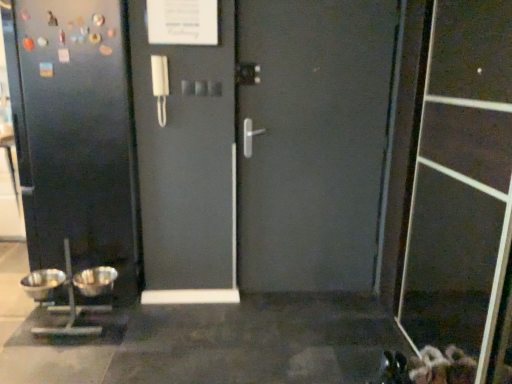
The width and height of the screenshot is (512, 384). What do you see at coordinates (77, 137) in the screenshot? I see `metallic gray door at center` at bounding box center [77, 137].

At what (x,y) coordinates should I click in order to perform the action: click on silver metallic mixing bowl at lower left, marked as the 1th mixing bowl in a right-to-left arrangement. Please return your answer as a coordinate pair (x, y). This screenshot has width=512, height=384. Looking at the image, I should click on (95, 281).

Is silver metallic mixing bowl at lower left, the 2th mixing bowl when ordered from right to left, completely or partially outside of metallic gray door at center?

Yes, silver metallic mixing bowl at lower left, the 2th mixing bowl when ordered from right to left, is outside of metallic gray door at center.

Is there a large distance between silver metallic mixing bowl at lower left, which appears as the 1th mixing bowl when viewed from the left, and metallic gray door at center?

silver metallic mixing bowl at lower left, which appears as the 1th mixing bowl when viewed from the left, is actually quite close to metallic gray door at center.

Which point is more forward, (28,279) or (19,137)?

The point (19,137) is more forward.

Is silver metallic mixing bowl at lower left, which appears as the 1th mixing bowl when viewed from the left, looking in the opposite direction of metallic gray door at center?

Yes, silver metallic mixing bowl at lower left, which appears as the 1th mixing bowl when viewed from the left, is facing away from metallic gray door at center.

Is metallic gray door at center to the right of transparent plastic screen door at lower right from the viewer's perspective?

No, metallic gray door at center is not to the right of transparent plastic screen door at lower right.

Would you say metallic gray door at center is outside transparent plastic screen door at lower right?

Yes, metallic gray door at center is outside of transparent plastic screen door at lower right.

From the picture: From the image's perspective, would you say metallic gray door at center is shown under transparent plastic screen door at lower right?

No, from the image's perspective, metallic gray door at center is not beneath transparent plastic screen door at lower right.

Between metallic gray door at center and transparent plastic screen door at lower right, which one has smaller size?

With smaller size is transparent plastic screen door at lower right.

From a real-world perspective, is silver metallic mixing bowl at lower left, marked as the second mixing bowl in a left-to-right arrangement, physically located above or below metallic gray door at center?

In terms of real-world spatial position, silver metallic mixing bowl at lower left, marked as the second mixing bowl in a left-to-right arrangement, is below metallic gray door at center.

You are a GUI agent. You are given a task and a screenshot of the screen. Output one action in this format:
    pyautogui.click(x=<x>, y=<y>)
    Task: Click on the door to the left of silver metallic mixing bowl at lower left, marked as the second mixing bowl in a left-to-right arrangement
    The height and width of the screenshot is (384, 512).
    Given the screenshot: What is the action you would take?
    pyautogui.click(x=77, y=137)

In the scene shown: Between silver metallic mixing bowl at lower left, marked as the 1th mixing bowl in a right-to-left arrangement, and metallic gray door at center, which one appears on the right side from the viewer's perspective?

silver metallic mixing bowl at lower left, marked as the 1th mixing bowl in a right-to-left arrangement, is more to the right.

From the image's perspective, is silver metallic mixing bowl at lower left, marked as the second mixing bowl in a left-to-right arrangement, located above metallic gray door at center?

No.

You are a GUI agent. You are given a task and a screenshot of the screen. Output one action in this format:
    pyautogui.click(x=<x>, y=<y>)
    Task: Click on the mixing bowl behind the silver metallic mixing bowl at lower left, the 2th mixing bowl when ordered from right to left
    
    Given the screenshot: What is the action you would take?
    pyautogui.click(x=95, y=281)

Does silver metallic mixing bowl at lower left, marked as the 1th mixing bowl in a right-to-left arrangement, have a greater height compared to silver metallic mixing bowl at lower left, the 2th mixing bowl when ordered from right to left?

No, silver metallic mixing bowl at lower left, marked as the 1th mixing bowl in a right-to-left arrangement, is not taller than silver metallic mixing bowl at lower left, the 2th mixing bowl when ordered from right to left.

Considering the sizes of objects silver metallic mixing bowl at lower left, marked as the 1th mixing bowl in a right-to-left arrangement, and silver metallic mixing bowl at lower left, which appears as the 1th mixing bowl when viewed from the left, in the image provided, who is thinner, silver metallic mixing bowl at lower left, marked as the 1th mixing bowl in a right-to-left arrangement, or silver metallic mixing bowl at lower left, which appears as the 1th mixing bowl when viewed from the left,?

With smaller width is silver metallic mixing bowl at lower left, marked as the 1th mixing bowl in a right-to-left arrangement.

Considering the relative sizes of silver metallic mixing bowl at lower left, marked as the 1th mixing bowl in a right-to-left arrangement, and silver metallic mixing bowl at lower left, the 2th mixing bowl when ordered from right to left, in the image provided, is silver metallic mixing bowl at lower left, marked as the 1th mixing bowl in a right-to-left arrangement, bigger than silver metallic mixing bowl at lower left, the 2th mixing bowl when ordered from right to left,?

No.

In the image, is silver metallic mixing bowl at lower left, the 2th mixing bowl when ordered from right to left, on the left side or the right side of transparent plastic screen door at lower right?

Clearly, silver metallic mixing bowl at lower left, the 2th mixing bowl when ordered from right to left, is on the left of transparent plastic screen door at lower right in the image.

From the image's perspective, which is above, silver metallic mixing bowl at lower left, the 2th mixing bowl when ordered from right to left, or transparent plastic screen door at lower right?

transparent plastic screen door at lower right.

Looking at their sizes, would you say silver metallic mixing bowl at lower left, which appears as the 1th mixing bowl when viewed from the left, is wider or thinner than transparent plastic screen door at lower right?

Clearly, silver metallic mixing bowl at lower left, which appears as the 1th mixing bowl when viewed from the left, has more width compared to transparent plastic screen door at lower right.

Based on their sizes in the image, would you say silver metallic mixing bowl at lower left, which appears as the 1th mixing bowl when viewed from the left, is bigger or smaller than transparent plastic screen door at lower right?

Considering their sizes, silver metallic mixing bowl at lower left, which appears as the 1th mixing bowl when viewed from the left, takes up less space than transparent plastic screen door at lower right.

Can you tell me how much silver metallic bowls at lower left and silver metallic mixing bowl at lower left, marked as the 1th mixing bowl in a right-to-left arrangement, differ in facing direction?

There is a 0.000895-degree angle between the facing directions of silver metallic bowls at lower left and silver metallic mixing bowl at lower left, marked as the 1th mixing bowl in a right-to-left arrangement.

From the picture: Which object is closer to the camera, silver metallic bowls at lower left or silver metallic mixing bowl at lower left, marked as the second mixing bowl in a left-to-right arrangement?

Positioned in front is silver metallic bowls at lower left.

Can you confirm if silver metallic bowls at lower left is bigger than silver metallic mixing bowl at lower left, marked as the second mixing bowl in a left-to-right arrangement?

Yes.

Which object is wider, silver metallic bowls at lower left or silver metallic mixing bowl at lower left, marked as the 1th mixing bowl in a right-to-left arrangement?

Wider between the two is silver metallic bowls at lower left.

Between transparent plastic screen door at lower right and silver metallic mixing bowl at lower left, the 2th mixing bowl when ordered from right to left, which one has more height?

transparent plastic screen door at lower right is taller.

How different are the orientations of transparent plastic screen door at lower right and silver metallic mixing bowl at lower left, which appears as the 1th mixing bowl when viewed from the left, in degrees?

The angle between the facing direction of transparent plastic screen door at lower right and the facing direction of silver metallic mixing bowl at lower left, which appears as the 1th mixing bowl when viewed from the left, is 90 degrees.

From the image's perspective, which is above, transparent plastic screen door at lower right or silver metallic mixing bowl at lower left, the 2th mixing bowl when ordered from right to left?

transparent plastic screen door at lower right appears higher in the image.

At what (x,y) coordinates should I click in order to perform the action: click on the 2nd mixing bowl below when counting from the metallic gray door at center (from the image's perspective). Please return your answer as a coordinate pair (x, y). The image size is (512, 384). Looking at the image, I should click on [42, 283].

Image resolution: width=512 pixels, height=384 pixels. What are the coordinates of `door above the transparent plastic screen door at lower right (from the image's perspective)` in the screenshot? It's located at (77, 137).

Considering their positions, is silver metallic mixing bowl at lower left, which appears as the 1th mixing bowl when viewed from the left, positioned further to silver metallic bowls at lower left than silver metallic mixing bowl at lower left, marked as the second mixing bowl in a left-to-right arrangement?

The object further to silver metallic bowls at lower left is silver metallic mixing bowl at lower left, which appears as the 1th mixing bowl when viewed from the left.

Considering their positions, is metallic gray door at center positioned further to transparent plastic screen door at lower right than silver metallic mixing bowl at lower left, which appears as the 1th mixing bowl when viewed from the left?

Based on the image, silver metallic mixing bowl at lower left, which appears as the 1th mixing bowl when viewed from the left, appears to be further to transparent plastic screen door at lower right.

From the image, which object appears to be farther from silver metallic mixing bowl at lower left, marked as the second mixing bowl in a left-to-right arrangement, silver metallic mixing bowl at lower left, which appears as the 1th mixing bowl when viewed from the left, or metallic gray door at center?

Based on the image, metallic gray door at center appears to be further to silver metallic mixing bowl at lower left, marked as the second mixing bowl in a left-to-right arrangement.

When comparing their distances from silver metallic mixing bowl at lower left, marked as the second mixing bowl in a left-to-right arrangement, does silver metallic bowls at lower left or metallic gray door at center seem closer?

silver metallic bowls at lower left lies closer to silver metallic mixing bowl at lower left, marked as the second mixing bowl in a left-to-right arrangement, than the other object.

Based on the photo, estimate the real-world distances between objects in this image. Which object is closer to transparent plastic screen door at lower right, silver metallic mixing bowl at lower left, marked as the second mixing bowl in a left-to-right arrangement, or metallic gray door at center?

Based on the image, metallic gray door at center appears to be nearer to transparent plastic screen door at lower right.

Based on their spatial positions, is silver metallic bowls at lower left or transparent plastic screen door at lower right closer to silver metallic mixing bowl at lower left, marked as the 1th mixing bowl in a right-to-left arrangement?

silver metallic bowls at lower left.

When comparing their distances from silver metallic bowls at lower left, does metallic gray door at center or silver metallic mixing bowl at lower left, marked as the 1th mixing bowl in a right-to-left arrangement, seem closer?

silver metallic mixing bowl at lower left, marked as the 1th mixing bowl in a right-to-left arrangement, is closer to silver metallic bowls at lower left.

Considering their positions, is silver metallic bowls at lower left positioned further to metallic gray door at center than transparent plastic screen door at lower right?

transparent plastic screen door at lower right.

The width and height of the screenshot is (512, 384). Find the location of `mixing bowl located between silver metallic bowls at lower left and transparent plastic screen door at lower right in the left-right direction`. mixing bowl located between silver metallic bowls at lower left and transparent plastic screen door at lower right in the left-right direction is located at coordinates (95, 281).

I want to click on mixing bowl between metallic gray door at center and transparent plastic screen door at lower right from left to right, so click(95, 281).

At what (x,y) coordinates should I click in order to perform the action: click on mixing bowl between metallic gray door at center and silver metallic mixing bowl at lower left, the 2th mixing bowl when ordered from right to left, from top to bottom. Please return your answer as a coordinate pair (x, y). Looking at the image, I should click on (95, 281).

Identify the location of appliance between metallic gray door at center and silver metallic mixing bowl at lower left, marked as the 1th mixing bowl in a right-to-left arrangement, in the vertical direction. (74, 296).